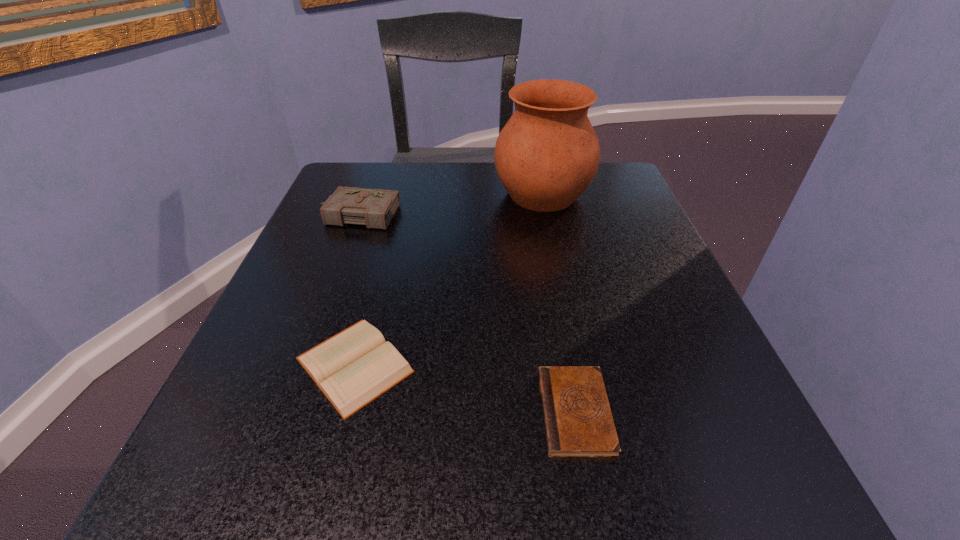
In the image, there is a desktop. Identify the location of vacant space at the left edge. Image resolution: width=960 pixels, height=540 pixels. (309, 249).

Where is `vacant space at the right edge`? vacant space at the right edge is located at coordinates (648, 217).

What are the coordinates of `vacant region at the far left corner` in the screenshot? It's located at (333, 185).

What are the coordinates of `free region at the near left corner` in the screenshot? It's located at (175, 492).

Image resolution: width=960 pixels, height=540 pixels. In order to click on vacant position at the far right corner of the desktop in this screenshot , I will do `click(635, 210)`.

Locate an element on the screen. free space between the rightmost diary and the second shortest object is located at coordinates (465, 388).

The width and height of the screenshot is (960, 540). I want to click on vacant area between the shortest diary and the farthest diary, so click(467, 313).

The height and width of the screenshot is (540, 960). I want to click on vacant space that is in between the farthest diary and the third tallest object, so click(x=356, y=290).

This screenshot has height=540, width=960. What are the coordinates of `free space between the third tallest object and the second tallest object` in the screenshot? It's located at (356, 290).

What are the coordinates of `empty space between the tallest object and the farthest diary` in the screenshot? It's located at (449, 204).